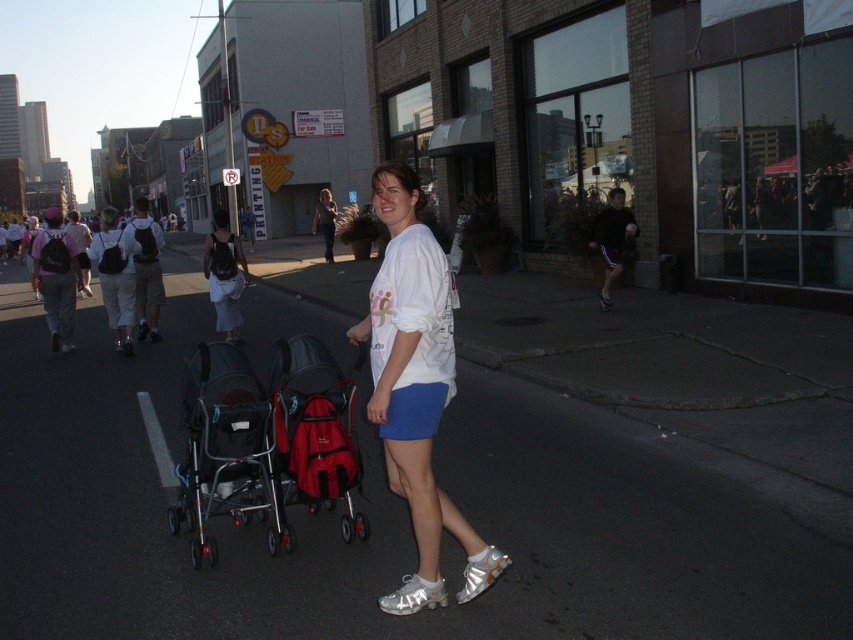
You are standing at the Printing Station sign and want to take a photo of both point (10, 316) and point (213, 340) in the same frame. Which point should you focus on first to ensure both are in focus?

You should focus on point (10, 316) first because it is closer to the viewer than point (213, 340). By focusing on the closer point, the farther point will also be within the depth of field.